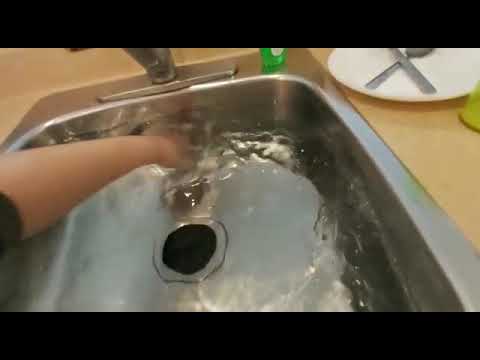
At what (x,y) coordinates should I click in order to perform the action: click on tap. Please return your answer as a coordinate pair (x, y). Image resolution: width=480 pixels, height=360 pixels. Looking at the image, I should click on (155, 64).